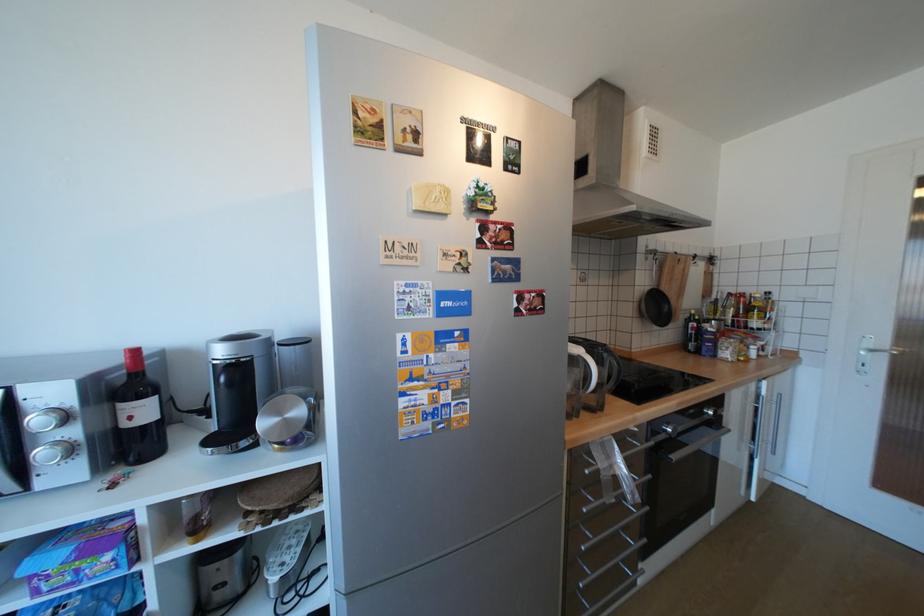
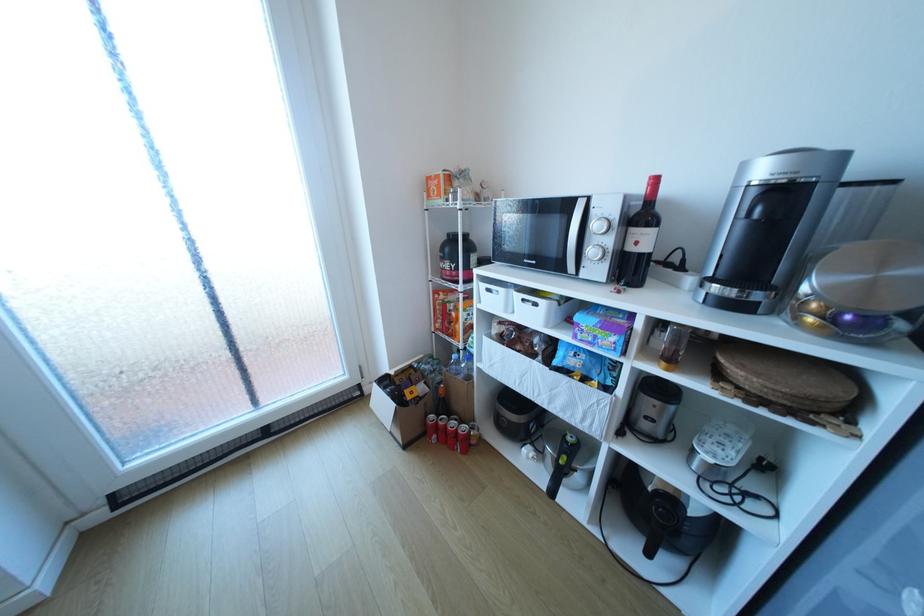
The images are taken continuously from a first-person perspective. In which direction is your viewpoint rotating?

The camera rotated toward left-down.